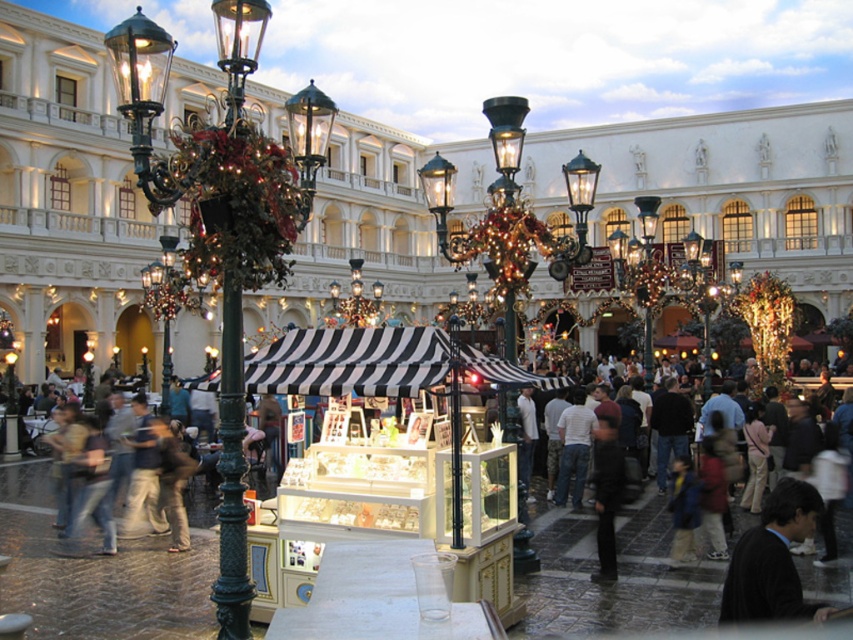
Question: Is polished brass lamp post at center bigger than black matte jacket at center?

Choices:
 (A) no
 (B) yes

Answer: (B)

Question: Which of the following is the closest to the observer?

Choices:
 (A) dark blue suit at lower right
 (B) polished brass lamp post at center
 (C) black matte jacket at center
 (D) polished brass lamp post at left

Answer: (A)

Question: Considering the real-world distances, which object is closest to the black matte jacket at center?

Choices:
 (A) polished brass lamp post at left
 (B) polished brass lamp post at center
 (C) dark blue suit at lower right

Answer: (B)

Question: Does polished brass lamp post at left appear on the right side of black matte jacket at center?

Choices:
 (A) yes
 (B) no

Answer: (B)

Question: Which of the following is the closest to the observer?

Choices:
 (A) (775, 545)
 (B) (222, 573)
 (C) (601, 419)
 (D) (463, 244)

Answer: (A)

Question: Considering the relative positions of polished brass lamp post at left and polished brass lamp post at center in the image provided, where is polished brass lamp post at left located with respect to polished brass lamp post at center?

Choices:
 (A) above
 (B) below

Answer: (A)